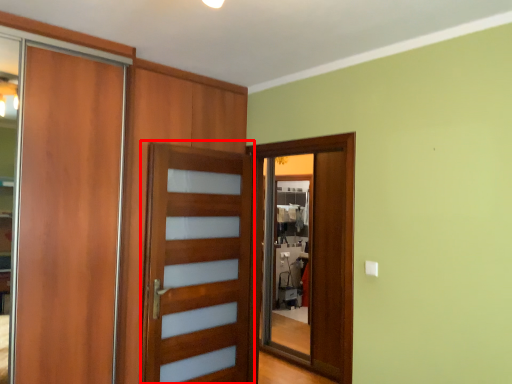
Question: From the image, what is the correct spatial relationship of screen door (annotated by the red box) in relation to screen door?

Choices:
 (A) right
 (B) left

Answer: (B)